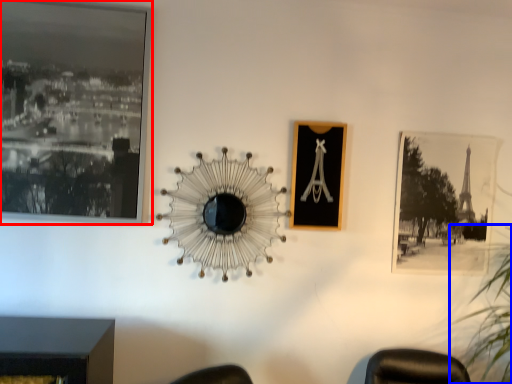
Question: Which point is further to the camera, picture frame (highlighted by a red box) or plant (highlighted by a blue box)?

Choices:
 (A) picture frame
 (B) plant

Answer: (A)